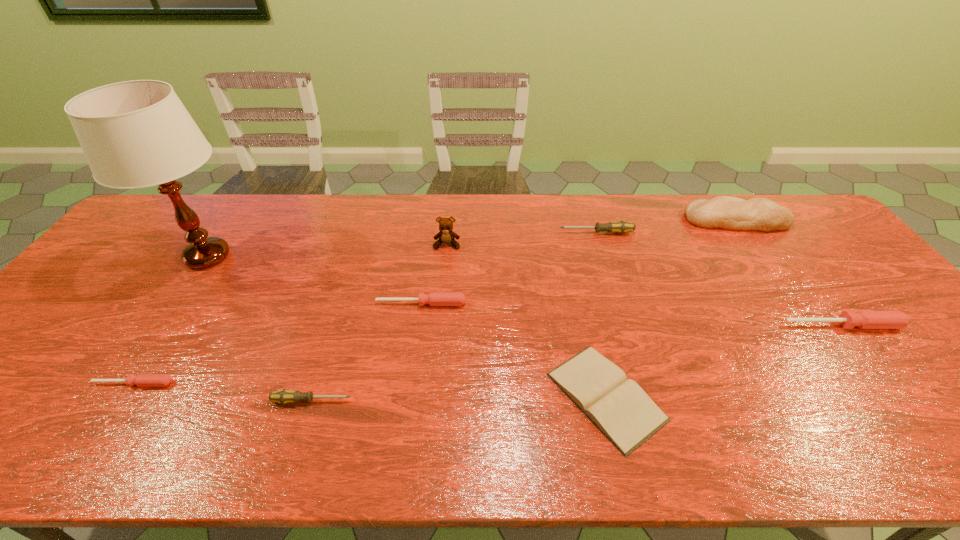
Where is `vacant space that is in between the seventh shortest object and the Bible`? This screenshot has width=960, height=540. vacant space that is in between the seventh shortest object and the Bible is located at coordinates click(x=671, y=308).

Identify the location of object that stands as the eighth closest to the second red screwdriver from left to right. (861, 319).

The height and width of the screenshot is (540, 960). What are the coordinates of `object that is the fourth closest to the teddy bear` in the screenshot? It's located at (284, 396).

Locate which screwdriver ranks fifth in proximity to the brown table lamp. Please provide its 2D coordinates. Your answer should be formatted as a tuple, i.e. [(x, y)], where the tuple contains the x and y coordinates of a point satisfying the conditions above.

[(861, 319)]

Select which screwdriver appears as the closest to the teddy bear. Please provide its 2D coordinates. Your answer should be formatted as a tuple, i.e. [(x, y)], where the tuple contains the x and y coordinates of a point satisfying the conditions above.

[(434, 298)]

Locate which red screwdriver is the closest to the brown teddy bear. Please provide its 2D coordinates. Your answer should be formatted as a tuple, i.e. [(x, y)], where the tuple contains the x and y coordinates of a point satisfying the conditions above.

[(434, 298)]

Choose which red screwdriver is the nearest neighbor to the bread. Please provide its 2D coordinates. Your answer should be formatted as a tuple, i.e. [(x, y)], where the tuple contains the x and y coordinates of a point satisfying the conditions above.

[(861, 319)]

Locate an element on the screen. vacant space that satisfies the following two spatial constraints: 1. at the tip of the second screwdriver from right to left; 2. on the front side of the fifth farthest object is located at coordinates (618, 303).

Where is `vacant point that satisfies the following two spatial constraints: 1. at the tip of the right gray screwdriver; 2. on the right side of the rightmost screwdriver`? The width and height of the screenshot is (960, 540). vacant point that satisfies the following two spatial constraints: 1. at the tip of the right gray screwdriver; 2. on the right side of the rightmost screwdriver is located at coordinates (624, 325).

At what (x,y) coordinates should I click in order to perform the action: click on vacant space that satisfies the following two spatial constraints: 1. at the tip of the right gray screwdriver; 2. on the front-facing side of the eighth shortest object. Please return your answer as a coordinate pair (x, y). This screenshot has width=960, height=540. Looking at the image, I should click on (600, 244).